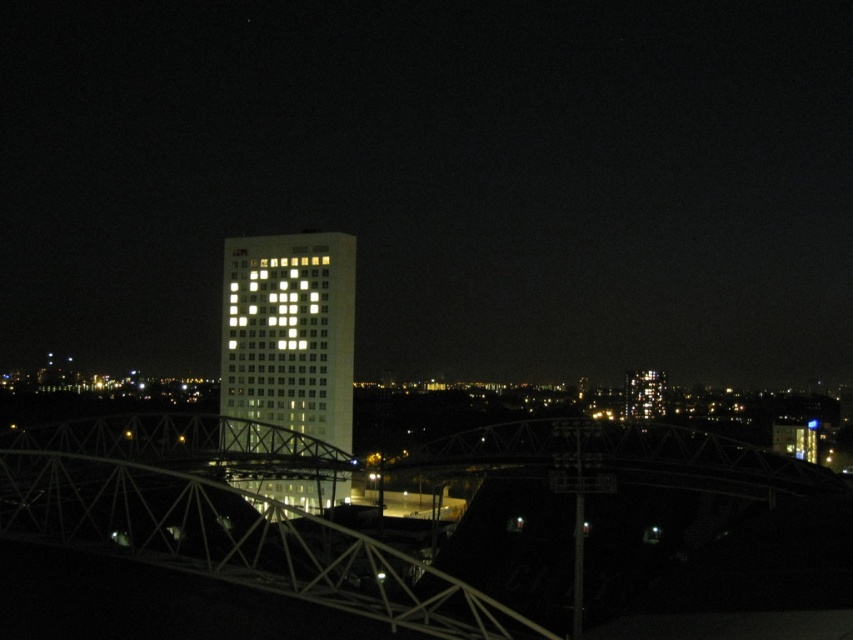
Question: Is white metallic bridge at center to the right of white illuminated building at center from the viewer's perspective?

Choices:
 (A) yes
 (B) no

Answer: (A)

Question: Among these points, which one is farthest from the camera?

Choices:
 (A) (305, 326)
 (B) (77, 496)

Answer: (A)

Question: Does white metallic bridge at center come in front of white illuminated building at center?

Choices:
 (A) yes
 (B) no

Answer: (A)

Question: Does white metallic bridge at center appear on the left side of white illuminated building at center?

Choices:
 (A) yes
 (B) no

Answer: (B)